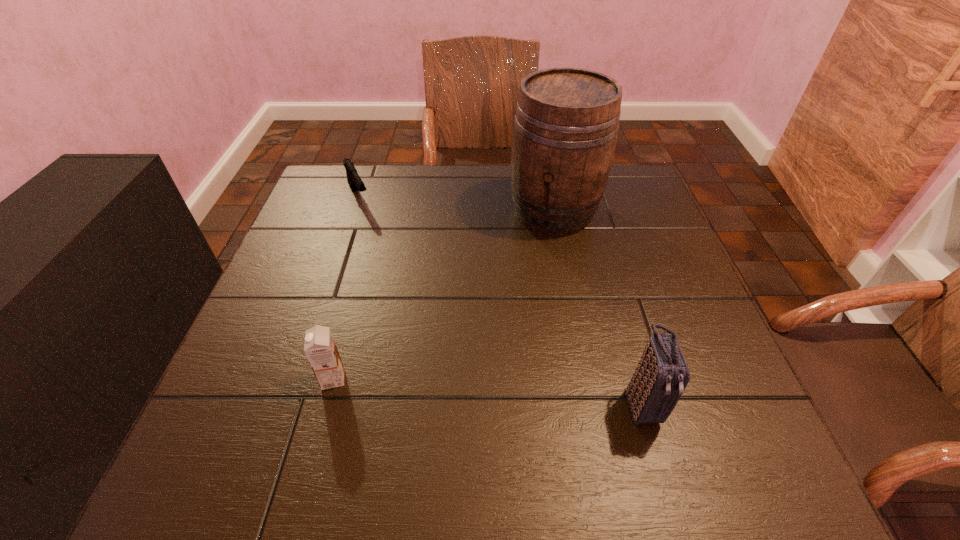
Locate an element on the screen. Image resolution: width=960 pixels, height=540 pixels. object located in the near right corner section of the desktop is located at coordinates (662, 374).

Image resolution: width=960 pixels, height=540 pixels. Find the location of `free space at the far edge of the desktop`. free space at the far edge of the desktop is located at coordinates (500, 200).

At what (x,y) coordinates should I click in order to perform the action: click on free region at the near edge. Please return your answer as a coordinate pair (x, y). This screenshot has height=540, width=960. Looking at the image, I should click on (416, 395).

Locate an element on the screen. The height and width of the screenshot is (540, 960). vacant space at the left edge of the desktop is located at coordinates (304, 353).

The height and width of the screenshot is (540, 960). I want to click on vacant space at the right edge of the desktop, so click(634, 217).

I want to click on vacant area at the far left corner of the desktop, so click(x=368, y=170).

Find the location of a particular element. The width and height of the screenshot is (960, 540). vacant point at the far right corner is located at coordinates (629, 183).

The height and width of the screenshot is (540, 960). In order to click on vacant region at the near right corner in this screenshot , I will do `click(692, 400)`.

Find the location of a particular element. The image size is (960, 540). unoccupied position between the tallest object and the pistol is located at coordinates (456, 204).

Locate an element on the screen. This screenshot has width=960, height=540. free area in between the chocolate milk and the shortest object is located at coordinates (346, 287).